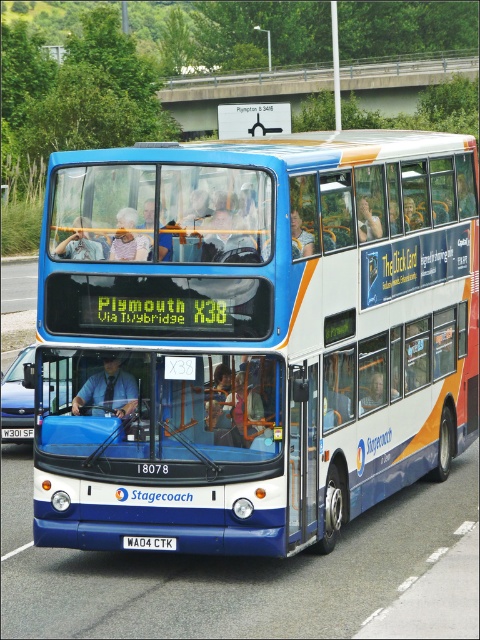
Does asphalt road at left have a lesser height compared to white plastic license plate at center?

No, asphalt road at left is not shorter than white plastic license plate at center.

Who is lower down, asphalt road at left or white plastic license plate at center?

Positioned lower is white plastic license plate at center.

Is point (28, 288) closer to camera compared to point (136, 540)?

No, (28, 288) is further to viewer.

Where is `asphalt road at left`? asphalt road at left is located at coordinates (19, 285).

Measure the distance between white plastic license plate at center and camera.

white plastic license plate at center and camera are 9.94 meters apart from each other.

Can you confirm if white plastic license plate at center is shorter than white plastic license plate at lower center?

Yes, white plastic license plate at center is shorter than white plastic license plate at lower center.

Is point (144, 541) farther from viewer compared to point (24, 428)?

No, (144, 541) is in front of (24, 428).

Identify the location of white plastic license plate at center. (149, 541).

Between matte blue bus at center and asphalt road at left, which one appears on the right side from the viewer's perspective?

matte blue bus at center is more to the right.

In the scene shown: Who is positioned more to the left, matte blue bus at center or asphalt road at left?

From the viewer's perspective, asphalt road at left appears more on the left side.

Is point (307, 417) closer to viewer compared to point (21, 282)?

Yes, point (307, 417) is closer to viewer.

Locate an element on the screen. matte blue bus at center is located at coordinates (252, 337).